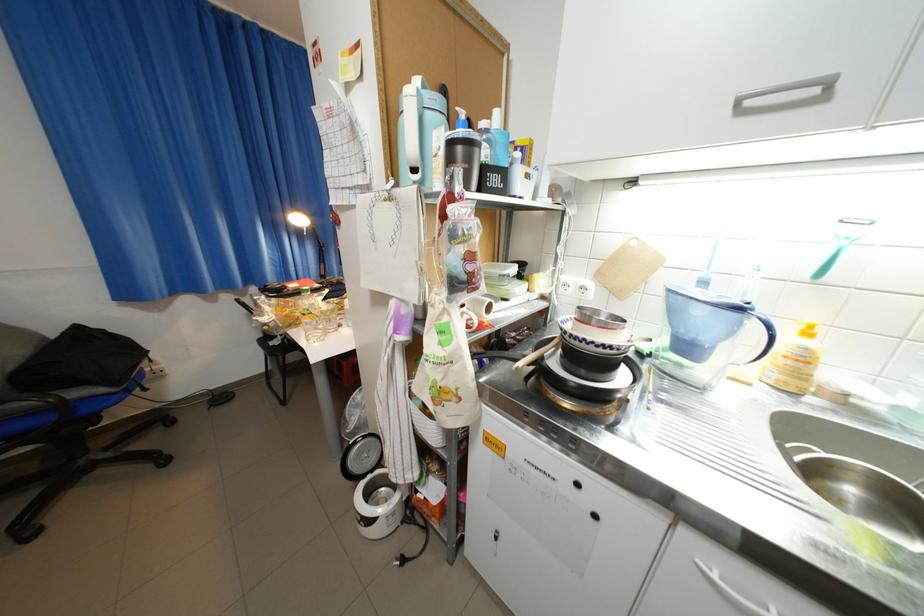
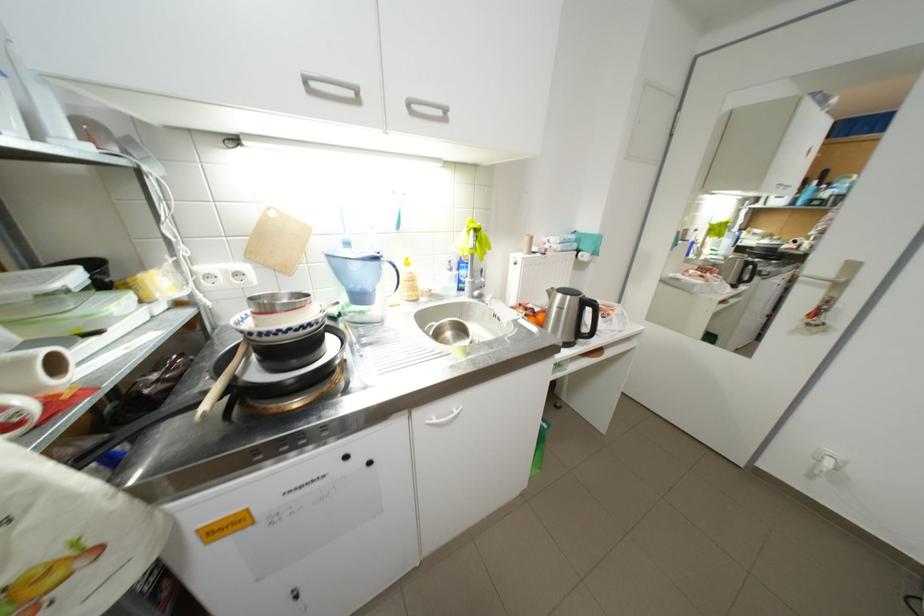
Where in the second image is the point corresponding to point (751, 310) from the first image?

(387, 259)